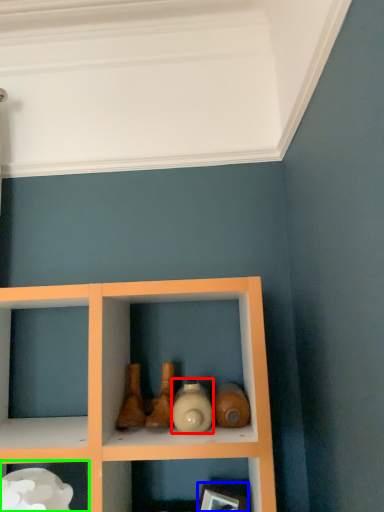
Question: Which object is positioned closest to bottle (highlighted by a red box)? Select from picture frame (highlighted by a blue box) and shelf (highlighted by a green box).

Choices:
 (A) picture frame
 (B) shelf

Answer: (A)